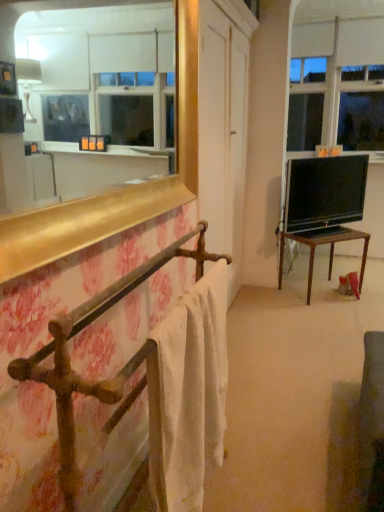
I want to click on vacant area that lies in front of wooden table at right, so click(327, 314).